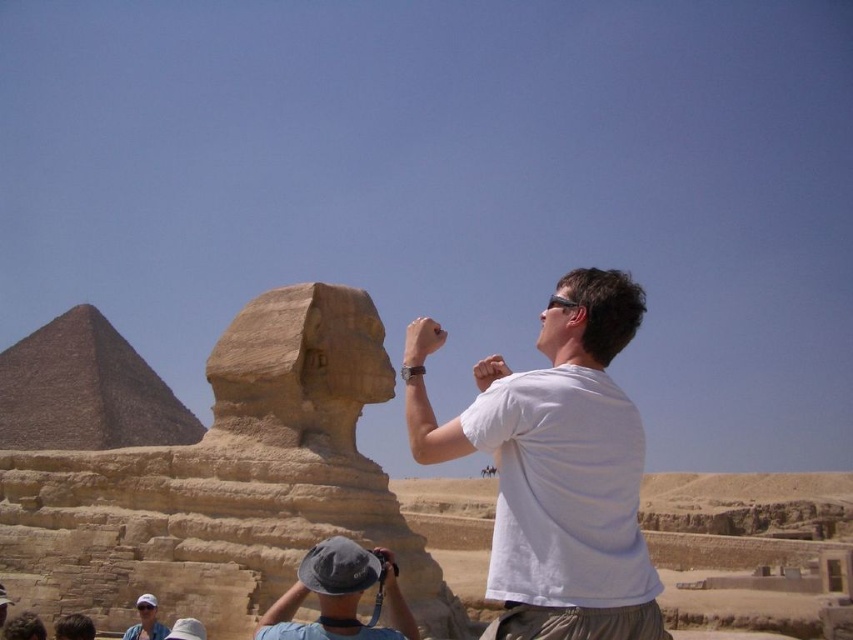
Is beige stone pyramid at left positioned at the back of gray fabric hat at center?

Yes.

Is point (44, 371) farther from viewer compared to point (386, 550)?

Yes, it is behind point (386, 550).

The image size is (853, 640). Describe the element at coordinates (85, 390) in the screenshot. I see `beige stone pyramid at left` at that location.

The height and width of the screenshot is (640, 853). Find the location of `beige stone pyramid at left`. beige stone pyramid at left is located at coordinates (85, 390).

Who is positioned more to the left, white cotton t-shirt at center or white cotton cap at lower left?

Positioned to the left is white cotton cap at lower left.

Is point (494, 436) less distant than point (146, 632)?

Yes, it is.

Find the location of a particular element. white cotton t-shirt at center is located at coordinates (555, 467).

Is white cotton t-shirt at center thinner than beige stone pyramid at left?

Yes, white cotton t-shirt at center is thinner than beige stone pyramid at left.

Can you confirm if white cotton t-shirt at center is positioned below beige stone pyramid at left?

Actually, white cotton t-shirt at center is above beige stone pyramid at left.

The width and height of the screenshot is (853, 640). Find the location of `white cotton t-shirt at center`. white cotton t-shirt at center is located at coordinates (555, 467).

What are the coordinates of `white cotton t-shirt at center` in the screenshot? It's located at (555, 467).